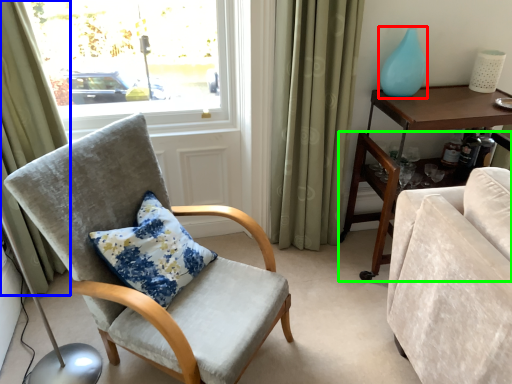
Question: Estimate the real-world distances between objects in this image. Which object is farther from glass vase (highlighted by a red box), curtain (highlighted by a blue box) or desk (highlighted by a green box)?

Choices:
 (A) curtain
 (B) desk

Answer: (A)